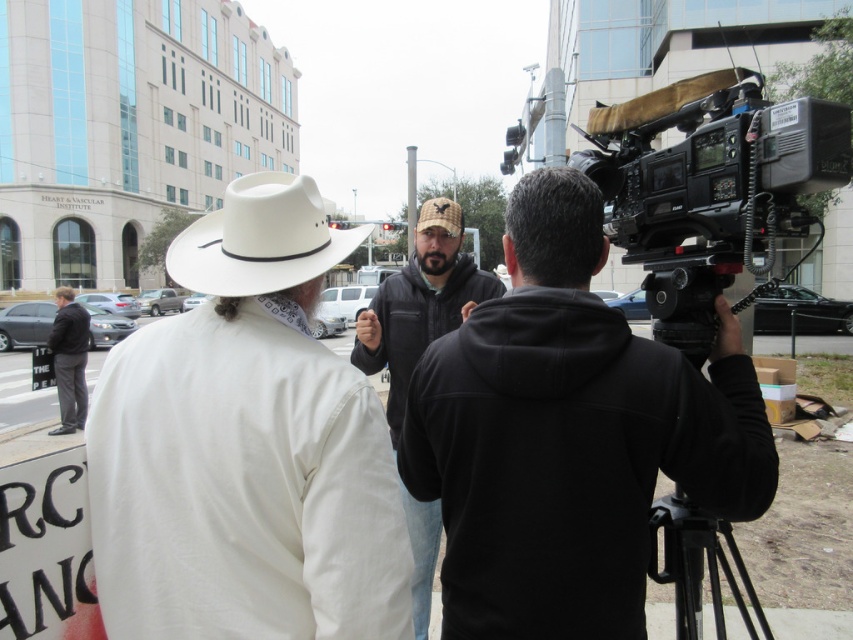
Question: Does white leather cowboy hat at left have a greater width compared to black matte tripod at right?

Choices:
 (A) no
 (B) yes

Answer: (B)

Question: Considering the real-world distances, which object is farthest from the white matte cowboy hat at upper left?

Choices:
 (A) dark gray hoodie at left
 (B) dark gray hoodie at center
 (C) white leather cowboy hat at left
 (D) black matte tripod at right

Answer: (A)

Question: Which of the following is the farthest from the observer?

Choices:
 (A) (711, 145)
 (B) (397, 344)

Answer: (B)

Question: Is black matte jacket at center to the right of dark gray hoodie at center from the viewer's perspective?

Choices:
 (A) no
 (B) yes

Answer: (B)

Question: Estimate the real-world distances between objects in this image. Which object is closer to the white matte cowboy hat at upper left?

Choices:
 (A) black matte jacket at center
 (B) black matte tripod at right

Answer: (A)

Question: Can you confirm if dark gray hoodie at center is wider than dark gray hoodie at left?

Choices:
 (A) yes
 (B) no

Answer: (B)